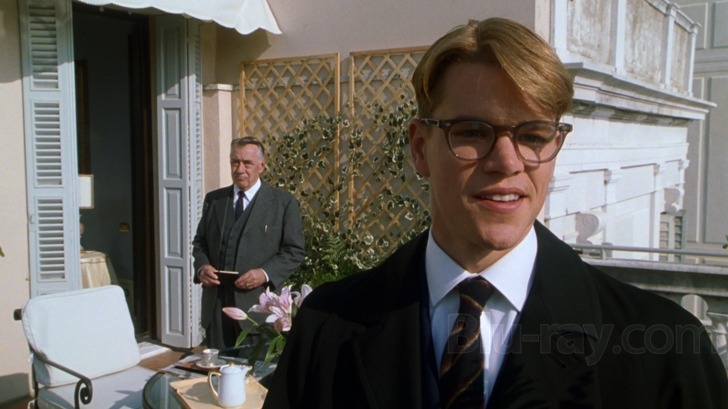
The height and width of the screenshot is (409, 728). I want to click on pitcher, so click(231, 386).